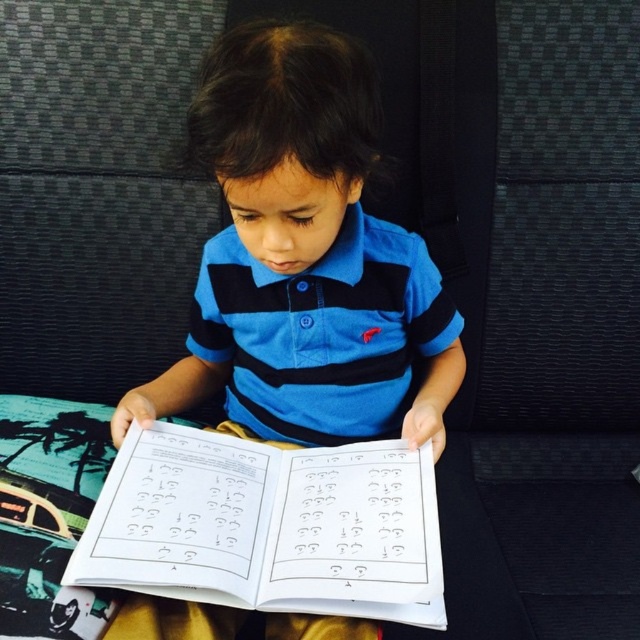
Question: Which object is positioned farthest from the blue striped shirt at center?

Choices:
 (A) white paper journal at center
 (B) blue striped polo shirt at center

Answer: (A)

Question: Which object appears closest to the camera in this image?

Choices:
 (A) blue striped polo shirt at center
 (B) white paper journal at center

Answer: (B)

Question: Does blue striped shirt at center have a lesser width compared to blue striped polo shirt at center?

Choices:
 (A) yes
 (B) no

Answer: (B)

Question: Is blue striped shirt at center positioned behind white paper journal at center?

Choices:
 (A) no
 (B) yes

Answer: (A)

Question: Does blue striped shirt at center appear over white paper journal at center?

Choices:
 (A) no
 (B) yes

Answer: (B)

Question: Which point is closer to the camera taking this photo?

Choices:
 (A) (320, 90)
 (B) (378, 218)
 (C) (408, 486)

Answer: (A)